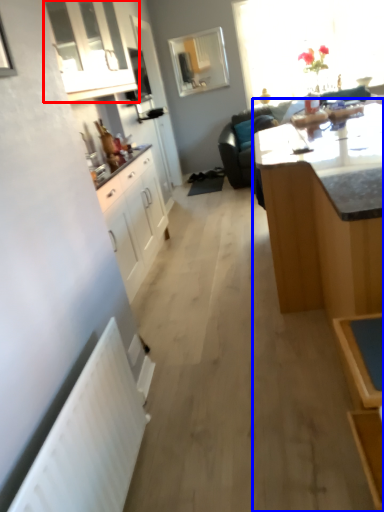
Question: Which of the following is the farthest to the observer, cabinetry (highlighted by a red box) or table (highlighted by a blue box)?

Choices:
 (A) cabinetry
 (B) table

Answer: (A)